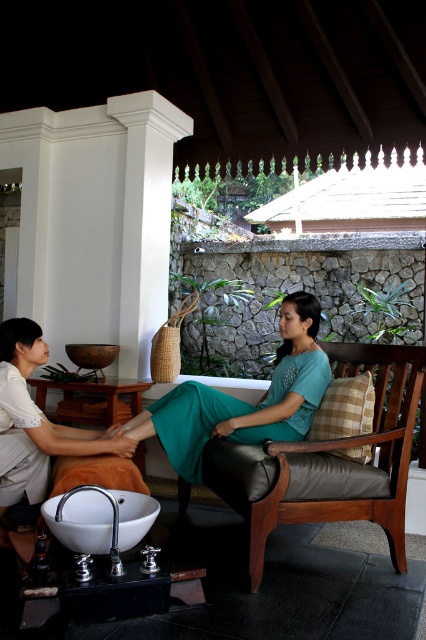
You are standing in the spa and want to locate two specific points marked in the image. The first point is at coordinates point [342,349], and the second point is at point [281,368]. Based on their positions, which point is closer to the front of the spa?

Point [281,368] is closer to the front of the spa because it is in front of point [342,349].

You are designing a layout for a spa room and need to place a decorative vase between the leather cushioned chair at center and the teal matte dress at center. Considering their sizes, which object should the vase be closer to?

The leather cushioned chair at center is thinner than the teal matte dress at center, so the vase should be placed closer to the teal matte dress at center to maintain balance in the layout.

You are standing at the entrance of the spa room and want to locate the leather cushioned chair at center. According to the coordinates provided, where would you find it?

The leather cushioned chair at center is located at coordinates point (328, 461).